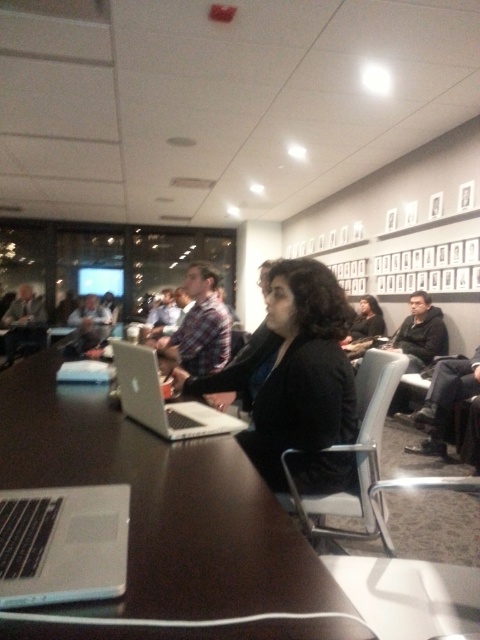
You are a person with a height of 165 cm standing in front of the dark wood table at center. Can you comfortably reach the top of the table without stretching?

The dark wood table at center is 62.37 centimeters away from the viewer. Since the distance is less than the average comfortable reaching distance of around 70 cm, you can comfortably reach the top of the dark wood table at center without stretching.

You are standing in the meeting room and want to move from the point at coordinates (x=23, y=412) to the point at coordinates (x=269, y=408). Which direction should you move to get closer to your destination?

You should move backward because the point at coordinates (x=23, y=412) is closer to you than the point at coordinates (x=269, y=408), so moving backward will take you toward the farther point.